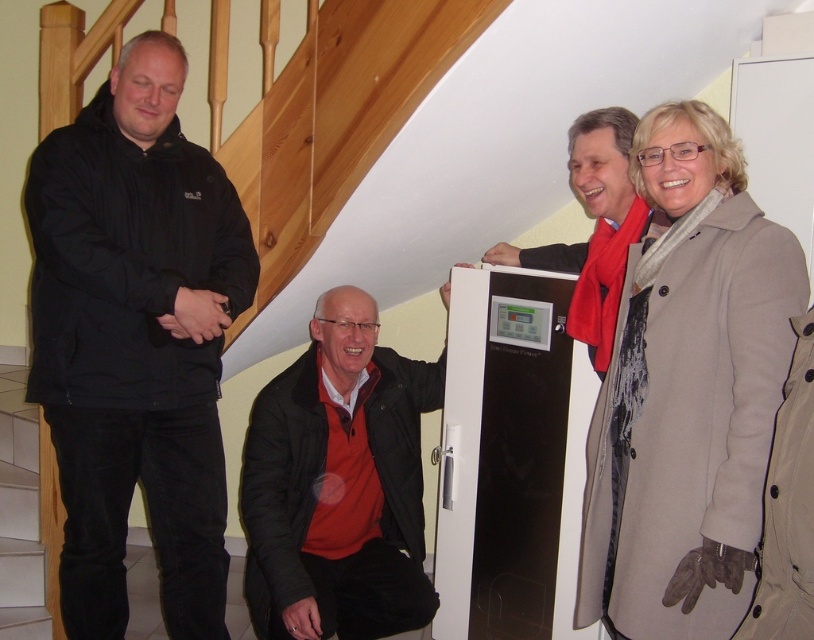
Please describe the location of the point with coordinates (134,340) in relation to the black matte jacket at left.

The point with coordinates (134,340) corresponds to the black matte jacket at left.

You are organizing a charity event and need to display two coats on a vertical rack. The beige wool coat at upper right and the black matte jacket at center must be arranged so that the taller one is placed above the shorter one. Based on the image, which coat should be placed higher on the rack?

The beige wool coat at upper right should be placed higher on the rack since it has a greater height compared to the black matte jacket at center.